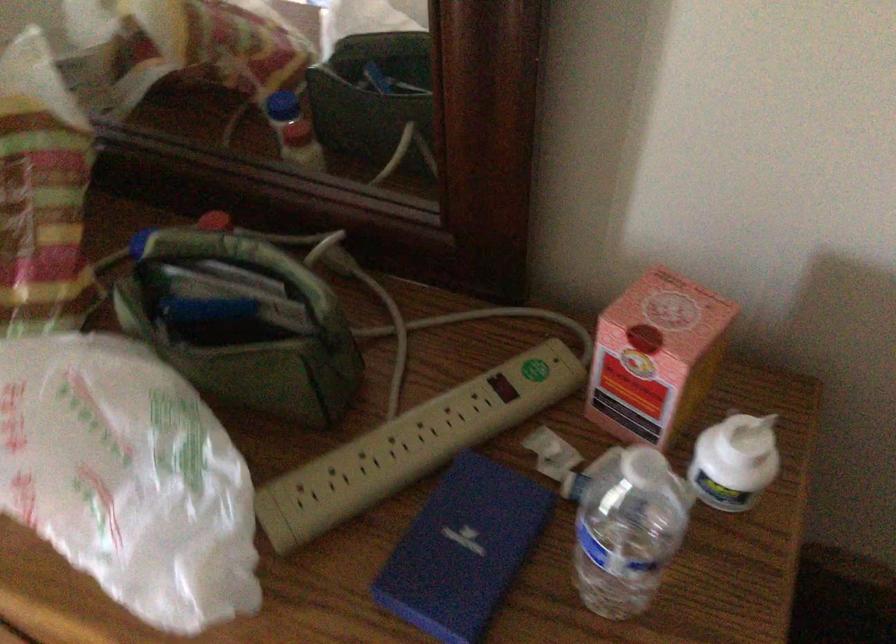
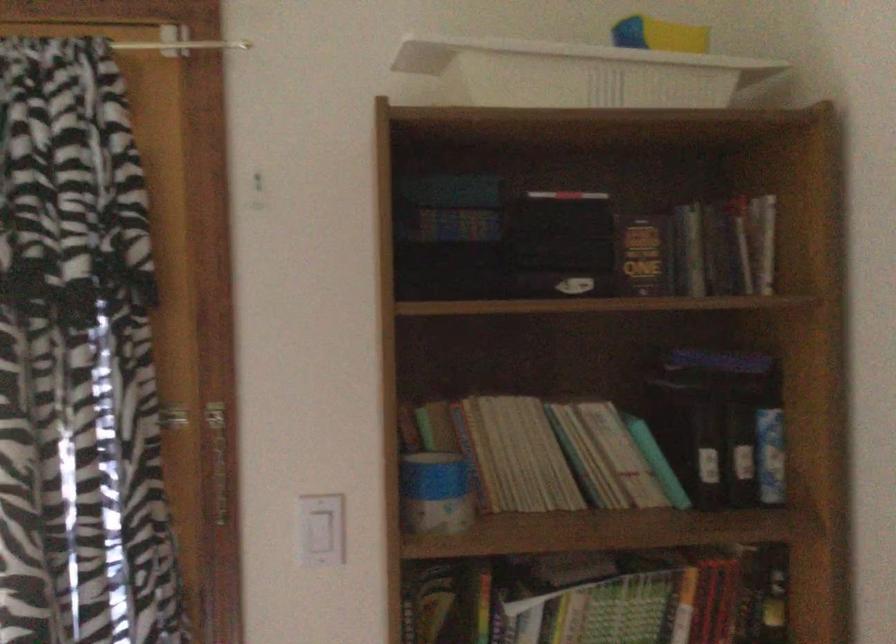
Based on the continuous images, in which direction is the camera rotating?

The rotation direction of the camera is left-up.